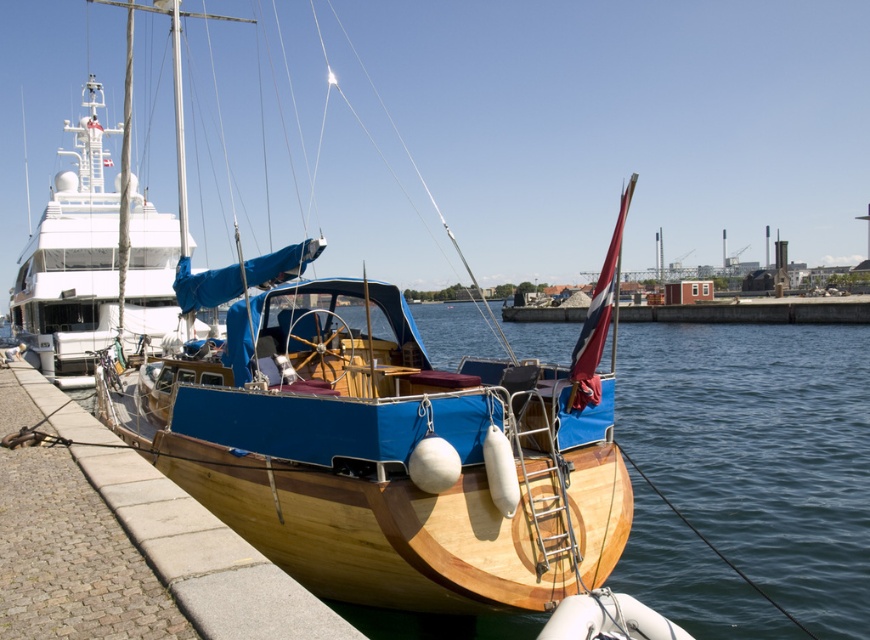
This screenshot has height=640, width=870. Describe the element at coordinates (379, 448) in the screenshot. I see `wooden sailboat at center` at that location.

Who is more forward, (561, 595) or (111, 500)?

Point (111, 500) is in front.

Is point (383, 496) behind point (256, 611)?

That is True.

The height and width of the screenshot is (640, 870). I want to click on wooden sailboat at center, so click(x=379, y=448).

Who is lower down, wooden sailboat at center or white glossy yacht at upper left?

wooden sailboat at center is lower down.

Does wooden sailboat at center appear under white glossy yacht at upper left?

Correct, wooden sailboat at center is located below white glossy yacht at upper left.

Which is behind, point (265, 404) or point (102, 189)?

The point (102, 189) is more distant.

This screenshot has width=870, height=640. I want to click on wooden sailboat at center, so click(x=379, y=448).

Is white glossy yacht at upper left positioned in front of brown wooden dock at lower left?

No, white glossy yacht at upper left is behind brown wooden dock at lower left.

Which is behind, point (79, 220) or point (229, 556)?

Point (79, 220)

This screenshot has width=870, height=640. In order to click on white glossy yacht at upper left in this screenshot , I will do `click(71, 260)`.